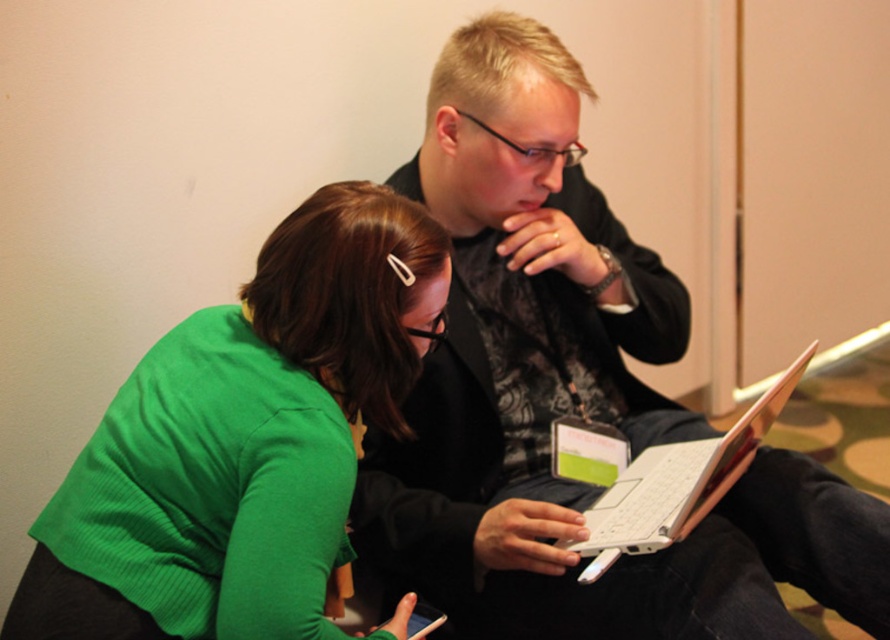
You are a delivery robot with a package that is 3.5 feet wide. You need to pass between the two people sitting at point [377,196]. Can you fit through the space between them?

The two people at point [377,196] are 3.37 feet apart, which is narrower than the 3.5 feet width of the package. Therefore, the delivery robot cannot fit through the space between them.

In the scene shown: You are a delivery robot with a package that measures 12 inches in width. You need to place it between the green ribbed sweater at lower left and yourself. Is there enough space to fit the package there?

The distance between the green ribbed sweater at lower left and the viewer is 34.35 inches. Since the package is only 12 inches wide, there is sufficient space to place it between the green ribbed sweater at lower left and yourself.

Based on the photo, you are a photographer taking a picture of the two people sitting at the laptop. You want to focus on the point closer to you between the two points marked as point 1 at (516, 516) and point 2 at (681, 520). Which point should you focus on?

You should focus on point 1 at (516, 516) because it is closer to you than point 2 at (681, 520).